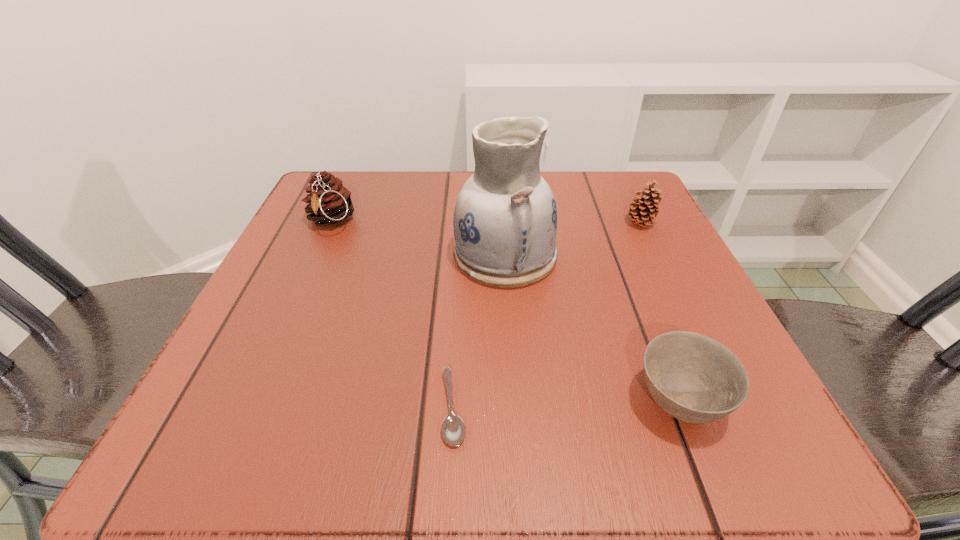
Locate an element on the screen. This screenshot has height=540, width=960. vacant space located on the right of the soupspoon is located at coordinates (606, 408).

Locate an element on the screen. Image resolution: width=960 pixels, height=540 pixels. pottery positioned at the far edge is located at coordinates (505, 220).

This screenshot has width=960, height=540. In order to click on bowl that is at the near edge in this screenshot , I will do `click(694, 378)`.

At what (x,y) coordinates should I click in order to perform the action: click on soupspoon situated at the near edge. Please return your answer as a coordinate pair (x, y). The height and width of the screenshot is (540, 960). Looking at the image, I should click on (453, 429).

The width and height of the screenshot is (960, 540). Identify the location of object at the left edge. (329, 202).

Find the location of a particular element. This screenshot has height=540, width=960. pinecone that is at the right edge is located at coordinates (643, 214).

The height and width of the screenshot is (540, 960). What are the coordinates of `bowl situated at the right edge` in the screenshot? It's located at (694, 378).

The image size is (960, 540). In order to click on object at the far left corner in this screenshot , I will do `click(329, 202)`.

Locate an element on the screen. This screenshot has height=540, width=960. object that is at the far right corner is located at coordinates (643, 214).

Locate an element on the screen. This screenshot has width=960, height=540. object that is positioned at the near right corner is located at coordinates (694, 378).